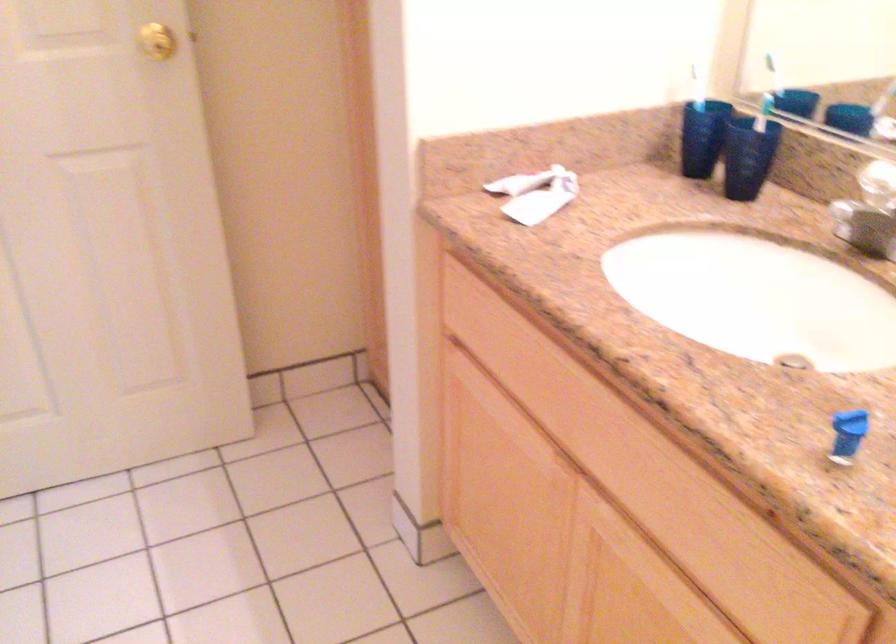
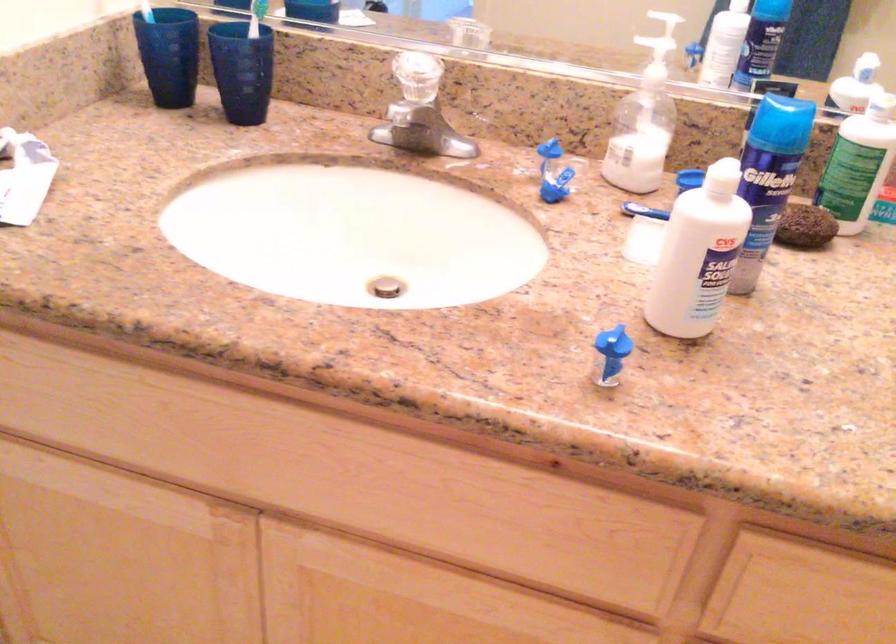
The point at (x=692, y=100) is marked in the first image. Where is the corresponding point in the second image?

(147, 11)